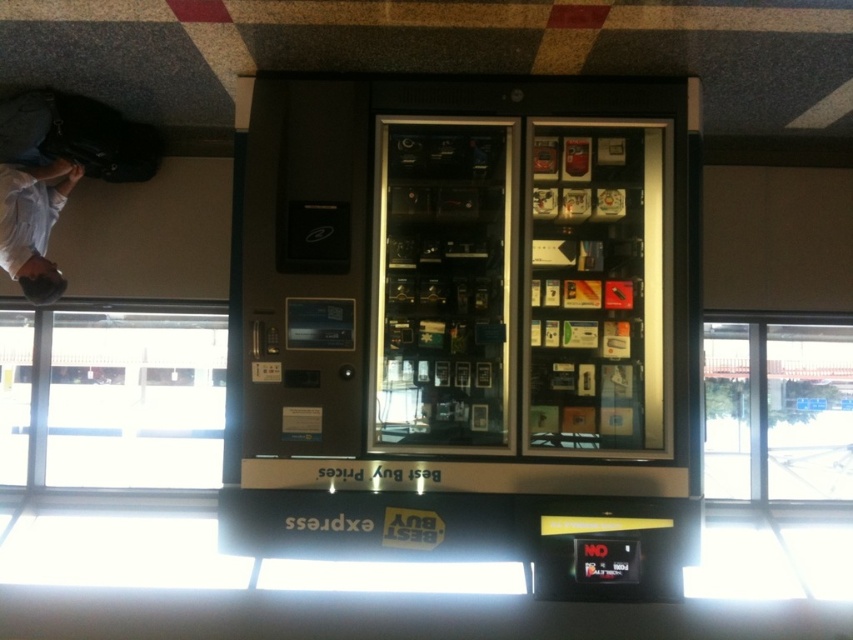
Question: Which point appears closest to the camera in this image?

Choices:
 (A) (413, 388)
 (B) (13, 237)

Answer: (A)

Question: Is metallic gray vending machine at center positioned before white fabric at upper left?

Choices:
 (A) no
 (B) yes

Answer: (B)

Question: Among these points, which one is nearest to the camera?

Choices:
 (A) (554, 189)
 (B) (39, 298)

Answer: (A)

Question: In this image, where is metallic gray vending machine at center located relative to white fabric at upper left?

Choices:
 (A) above
 (B) below

Answer: (B)

Question: Is metallic gray vending machine at center smaller than white fabric at upper left?

Choices:
 (A) no
 (B) yes

Answer: (A)